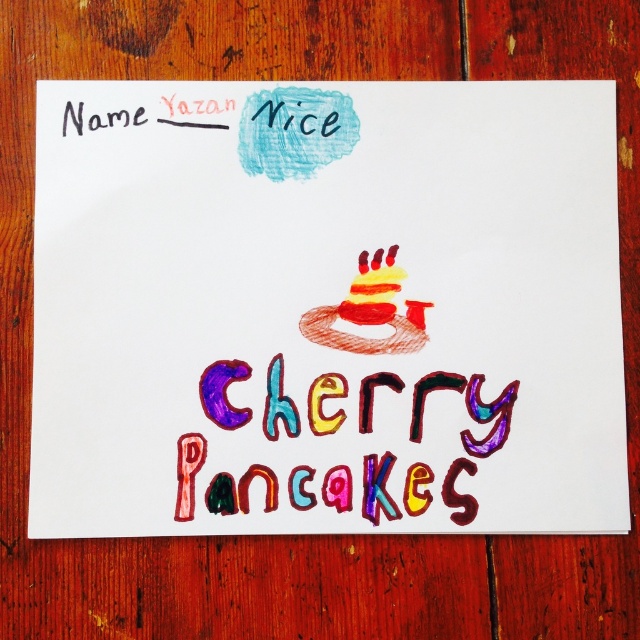
Question: Among these points, which one is farthest from the camera?

Choices:
 (A) (488, 196)
 (B) (300, 499)

Answer: (A)

Question: Is colored crayon pancake at center to the left of colorfulhand-drawncherry pancakes at center from the viewer's perspective?

Choices:
 (A) no
 (B) yes

Answer: (B)

Question: Among these objects, which one is farthest from the camera?

Choices:
 (A) colorfulhand-drawncherry pancakes at center
 (B) colored crayon pancake at center

Answer: (A)

Question: Is colored crayon pancake at center to the left of colorfulhand-drawncherry pancakes at center from the viewer's perspective?

Choices:
 (A) no
 (B) yes

Answer: (B)

Question: Does colored crayon pancake at center have a larger size compared to colorfulhand-drawncherry pancakes at center?

Choices:
 (A) no
 (B) yes

Answer: (B)

Question: Which point is farther to the camera?

Choices:
 (A) colored crayon pancake at center
 (B) colorfulhand-drawncherry pancakes at center

Answer: (B)